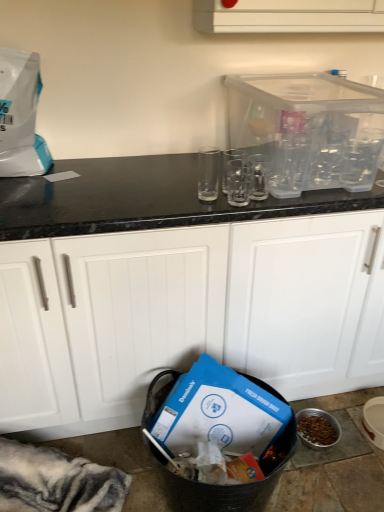
Locate an element on the screen. unoccupied area in front of clear glass at center, which ranks as the 2th clear in left-to-right order is located at coordinates (233, 214).